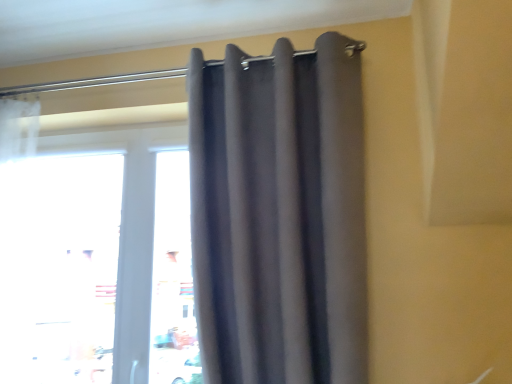
Question: Can you confirm if dark gray fabric curtain at upper center is positioned to the left of transparent glass window at center?

Choices:
 (A) no
 (B) yes

Answer: (A)

Question: Is dark gray fabric curtain at upper center bigger than transparent glass window at center?

Choices:
 (A) no
 (B) yes

Answer: (B)

Question: Is dark gray fabric curtain at upper center outside of transparent glass window at center?

Choices:
 (A) yes
 (B) no

Answer: (A)

Question: From the image's perspective, is dark gray fabric curtain at upper center beneath transparent glass window at center?

Choices:
 (A) no
 (B) yes

Answer: (A)

Question: Can you confirm if dark gray fabric curtain at upper center is smaller than transparent glass window at center?

Choices:
 (A) no
 (B) yes

Answer: (A)

Question: Can you confirm if dark gray fabric curtain at upper center is shorter than transparent glass window at center?

Choices:
 (A) no
 (B) yes

Answer: (A)

Question: Considering the relative sizes of transparent glass window at center and dark gray fabric curtain at upper center in the image provided, is transparent glass window at center smaller than dark gray fabric curtain at upper center?

Choices:
 (A) yes
 (B) no

Answer: (A)

Question: Is there a large distance between transparent glass window at center and dark gray fabric curtain at upper center?

Choices:
 (A) yes
 (B) no

Answer: (B)

Question: Is transparent glass window at center oriented away from dark gray fabric curtain at upper center?

Choices:
 (A) yes
 (B) no

Answer: (B)

Question: Does transparent glass window at center have a lesser height compared to dark gray fabric curtain at upper center?

Choices:
 (A) yes
 (B) no

Answer: (A)

Question: Does transparent glass window at center turn towards dark gray fabric curtain at upper center?

Choices:
 (A) yes
 (B) no

Answer: (B)

Question: Does transparent glass window at center lie behind dark gray fabric curtain at upper center?

Choices:
 (A) no
 (B) yes

Answer: (B)

Question: Is transparent glass window at center in front of or behind dark gray fabric curtain at upper center in the image?

Choices:
 (A) front
 (B) behind

Answer: (B)